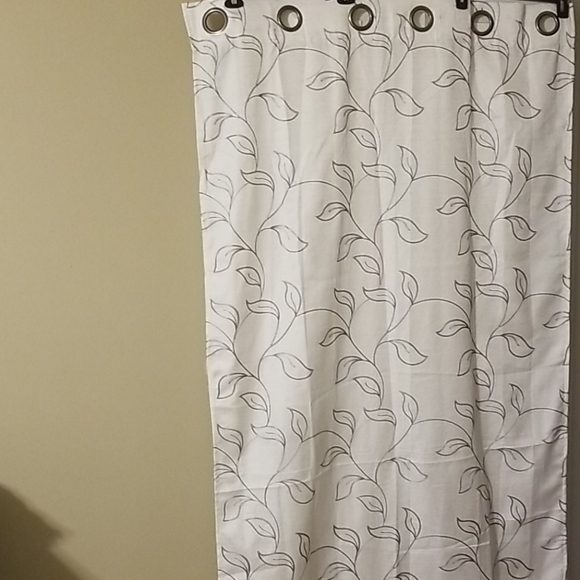
Locate an element on the screen. wwhite background of shower curtain is located at coordinates (313, 269).